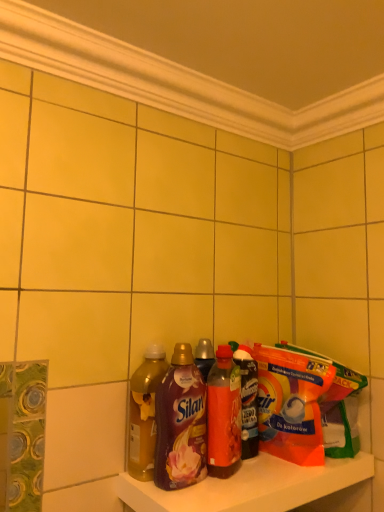
This screenshot has height=512, width=384. What are the coordinates of `vacant area that lies to the right of translucent amber liquid at shelf center, placed as the first bottle when sorted from left to right` in the screenshot? It's located at (239, 484).